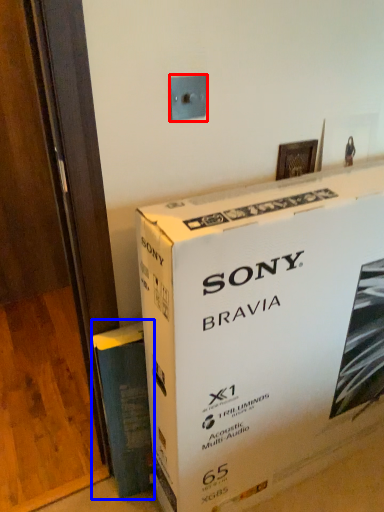
Question: Which of the following is the farthest to the observer, electric outlet (highlighted by a red box) or paperback book (highlighted by a blue box)?

Choices:
 (A) electric outlet
 (B) paperback book

Answer: (B)